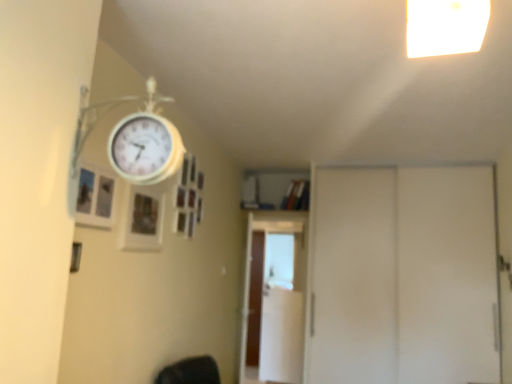
Question: Is brown wooden screen door at center, acting as the first screen door starting from the back, wider or thinner than white glossy screen door at center, marked as the second screen door in a left-to-right arrangement?

Choices:
 (A) wide
 (B) thin

Answer: (A)

Question: Visually, is brown wooden screen door at center, the third screen door when ordered from right to left, positioned to the left or to the right of white glossy screen door at center, which appears as the second screen door when viewed from the back?

Choices:
 (A) left
 (B) right

Answer: (A)

Question: Estimate the real-world distances between objects in this image. Which object is farther from the wooden picture frame at upper left, marked as the first picture frame in a left-to-right arrangement?

Choices:
 (A) wooden picture frame at upper center, marked as the 2th picture frame in a front-to-back arrangement
 (B) brown wooden screen door at center, the third screen door when ordered from right to left
 (C) white glossy screen door at center, the 2th screen door from the right
 (D) white matte screen door at right, the 3th screen door viewed from the back
 (E) white plastic light fixture at upper right

Answer: (C)

Question: Which is nearer to the wooden picture frame at upper center, marked as the 2th picture frame in a front-to-back arrangement?

Choices:
 (A) wooden picture frame at upper left, marked as the first picture frame in a left-to-right arrangement
 (B) white matte screen door at right, positioned as the first screen door in front-to-back order
 (C) white glossy screen door at center, marked as the second screen door in a left-to-right arrangement
 (D) white plastic light fixture at upper right
 (E) brown wooden screen door at center, the 3th screen door when ordered from front to back

Answer: (A)